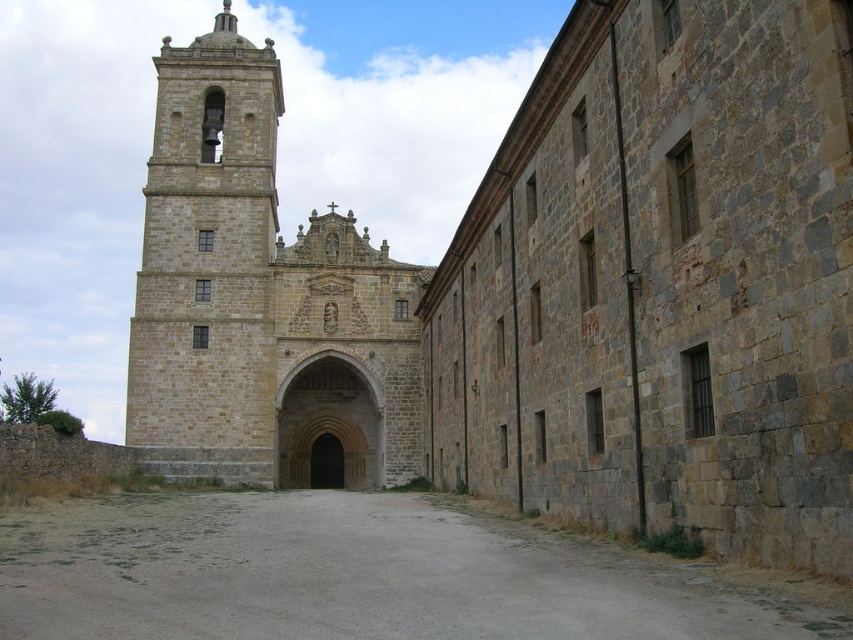
You are a tourist standing in the gray concrete alley at center and want to take a photo of the stone tower at center. Based on their sizes, which object should appear bigger in your photo?

The stone tower at center should appear bigger in your photo because it has a larger size compared to the gray concrete alley at center.

You are standing in front of the historic stone building and notice two points marked on the image. One is at coordinates point (219, 220) and the other at point (4, 624). Which point is closer to you?

Point (219, 220) is further to the camera than point (4, 624), so the point closer to you is point (4, 624).

You are a delivery person trying to navigate through the gray concrete alley at center with a wide delivery truck. The truck is 3 meters wide. Can the truck pass through the alley while avoiding the stone tower at center?

The stone tower at center has a lesser width compared to gray concrete alley at center. Since the truck is 3 meters wide and the alley is wider than the tower, the truck can pass through the alley as long as it stays centered and avoids the narrower tower area.